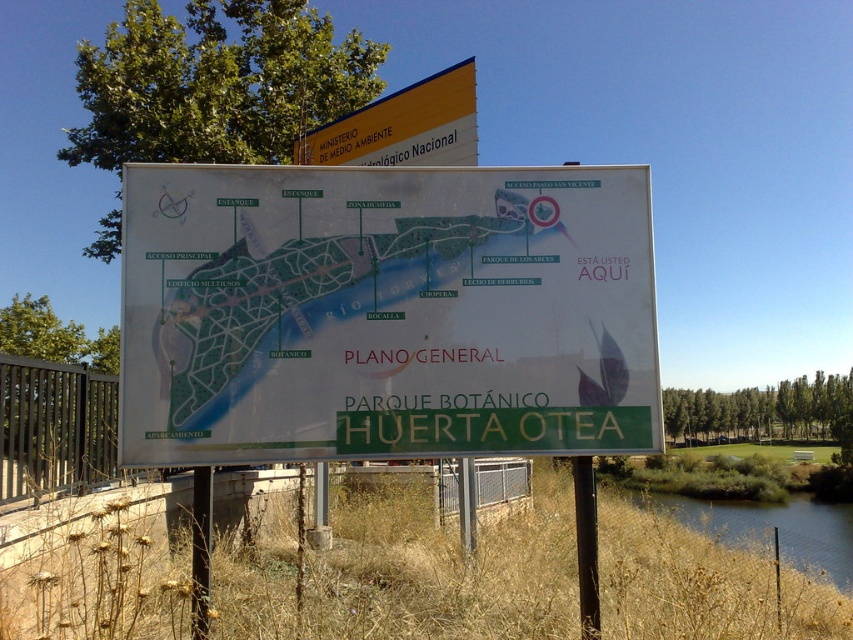
You are a visitor at the park and want to find the yellow plastic sign at upper center. From your current position near the green grassy river at lower right, which direction should you move to locate the sign?

The yellow plastic sign at upper center is in front of the green grassy river at lower right, so you should move towards the direction facing away from the river to find the sign.